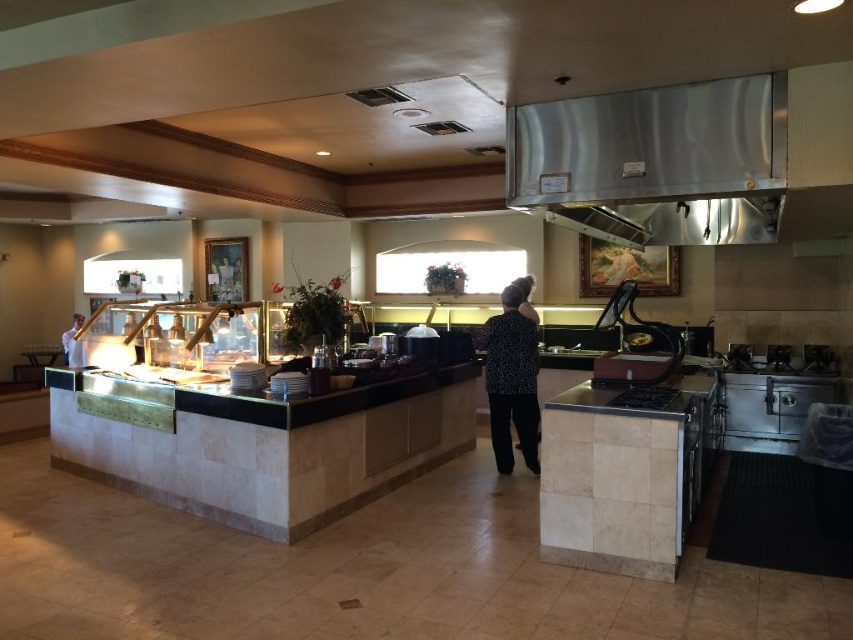
Question: Which point is closer to the camera taking this photo?

Choices:
 (A) (625, 225)
 (B) (74, 340)
 (C) (503, 378)

Answer: (C)

Question: Based on their relative distances, which object is nearer to the black dotted shirt at center?

Choices:
 (A) stainless steel exhaust hood at upper center
 (B) white shirt at left

Answer: (A)

Question: Is stainless steel exhaust hood at upper center below white shirt at left?

Choices:
 (A) yes
 (B) no

Answer: (B)

Question: Does black dotted shirt at center appear on the left side of white shirt at left?

Choices:
 (A) yes
 (B) no

Answer: (B)

Question: Which object is the closest to the stainless steel exhaust hood at upper center?

Choices:
 (A) white shirt at left
 (B) black dotted shirt at center

Answer: (B)

Question: Is black dotted shirt at center smaller than stainless steel exhaust hood at upper center?

Choices:
 (A) yes
 (B) no

Answer: (A)